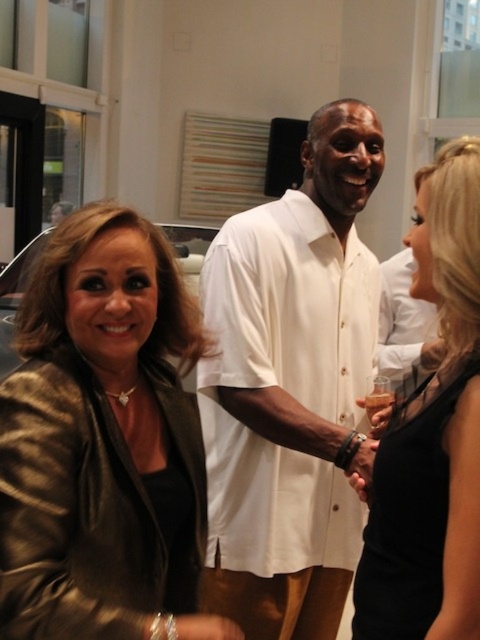
You are standing at the entrance of the room and want to walk towards the point at coordinates point (71, 228) and point (264, 236). Which point will you reach first?

You will reach point (71, 228) first because it is in front of point (264, 236) from your perspective at the entrance.

You are at a party and want to take a photo of the two people in the white cotton shirt at center and black satin dress at center. Which one is positioned higher in the frame?

The white cotton shirt at center is positioned higher in the frame than the black satin dress at center.